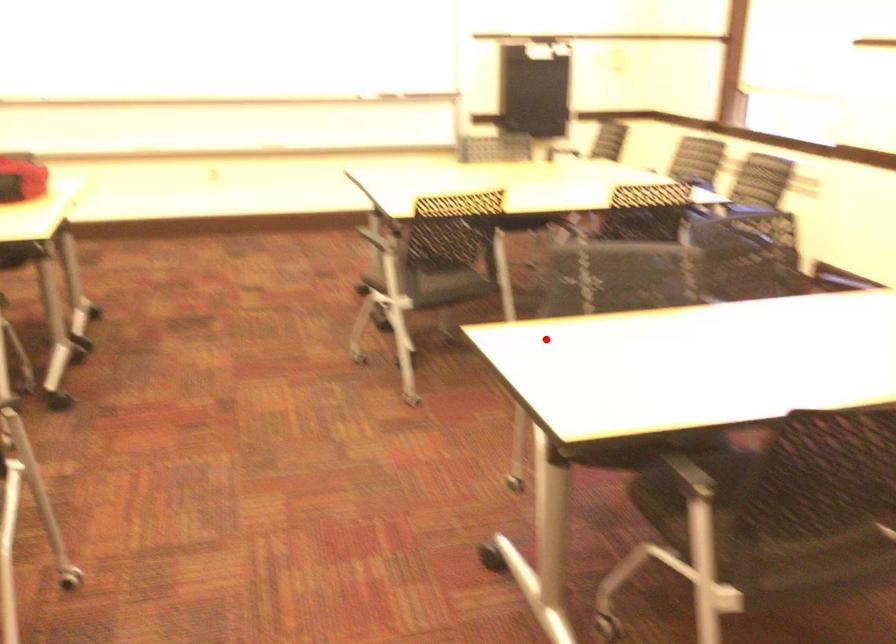
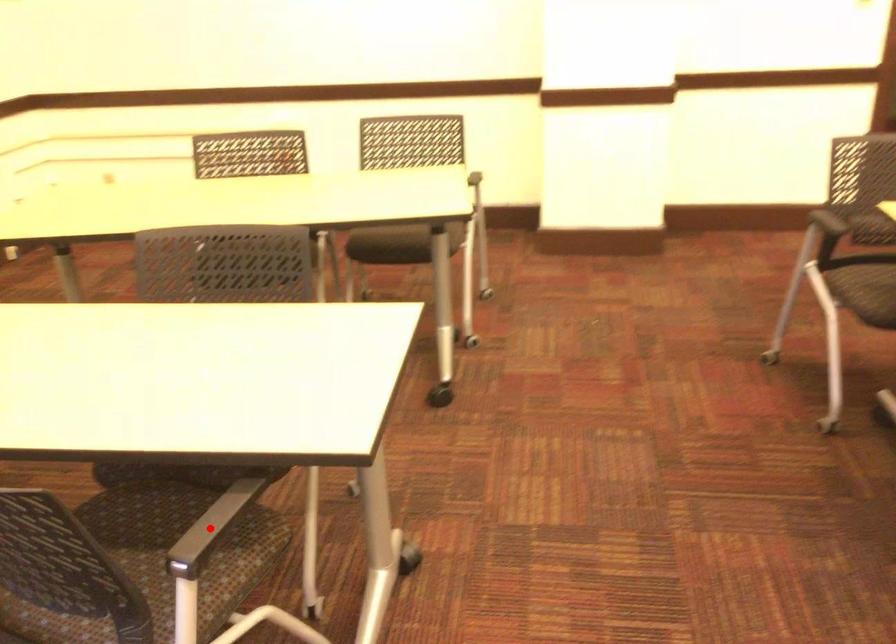
I am providing you with two images of the same scene from different viewpoints. A red point is marked on the first image and another point is marked on the second image. Does the point marked in image1 correspond to the same location as the one in image2?

Yes